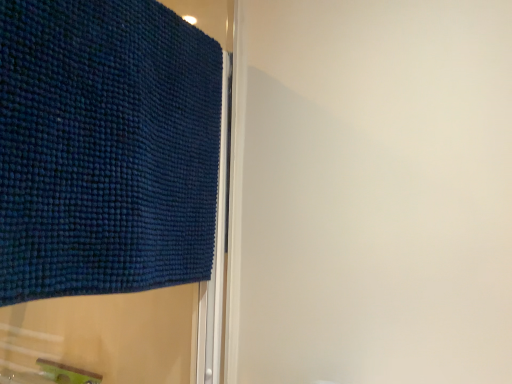
Identify the location of blue textured towel at upper left. (105, 148).

Describe the element at coordinates (105, 148) in the screenshot. I see `blue textured towel at upper left` at that location.

Where is `blue textured towel at upper left`? The image size is (512, 384). blue textured towel at upper left is located at coordinates (105, 148).